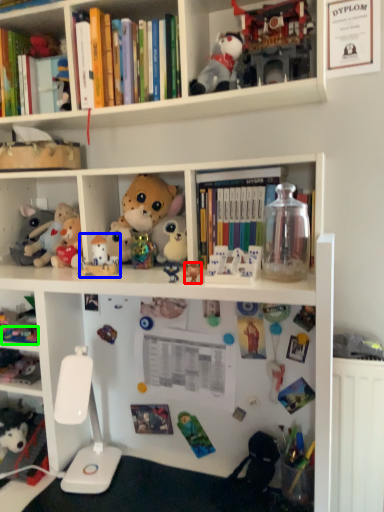
Question: Considering the real-world distances, which object is farthest from toy (highlighted by a red box)? toy (highlighted by a blue box) or toy (highlighted by a green box)?

Choices:
 (A) toy
 (B) toy

Answer: (B)